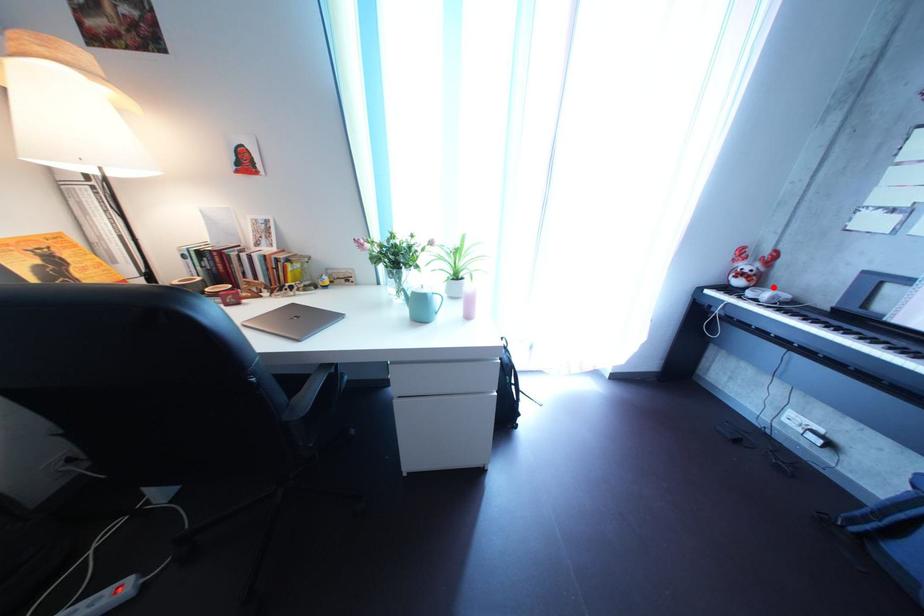
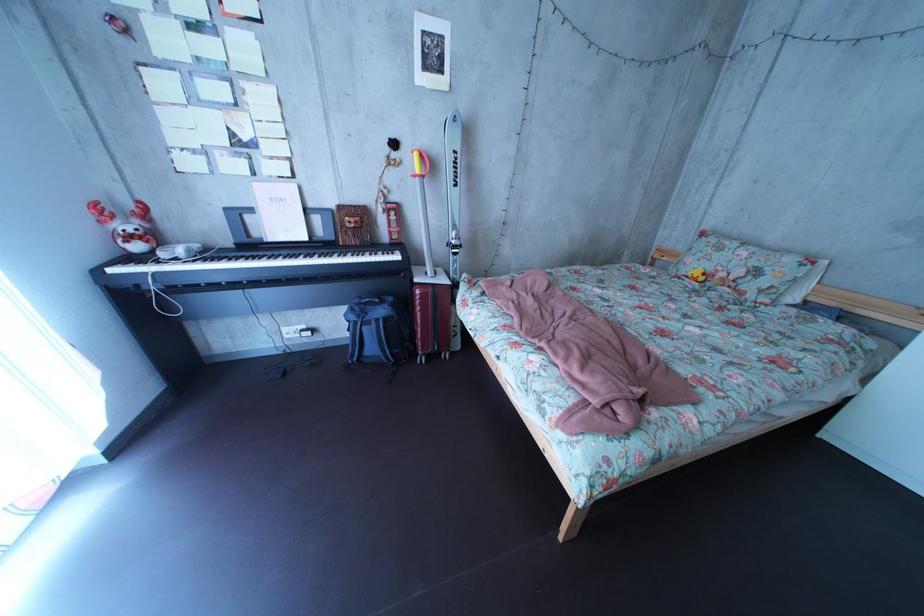
Find the pixel in the second image that matches the highlighted location in the first image.

(169, 246)